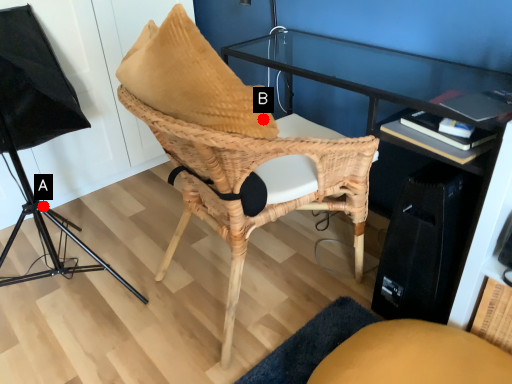
Question: Two points are circled on the image, labeled by A and B beside each circle. Which point is farther to the camera?

Choices:
 (A) A is further
 (B) B is further

Answer: (A)